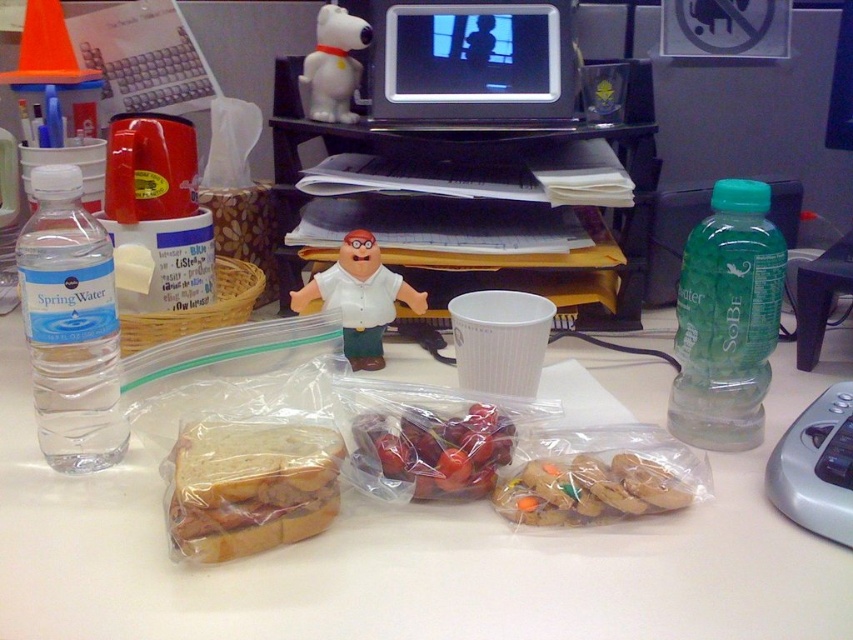
Question: Among these points, which one is farthest from the camera?

Choices:
 (A) (560, 93)
 (B) (419, 477)
 (C) (735, 346)
 (D) (334, 65)

Answer: (D)

Question: Is translucent plastic sandwich at center to the right of translucent plastic bag of gummy candies at center from the viewer's perspective?

Choices:
 (A) no
 (B) yes

Answer: (A)

Question: Which point is farther from the camera taking this photo?

Choices:
 (A) (354, 24)
 (B) (544, 29)
 (C) (549, 518)

Answer: (B)

Question: Does white matte figurine at center appear over white plastic snoopy at upper center?

Choices:
 (A) no
 (B) yes

Answer: (A)

Question: Does translucent plastic sandwich at center have a greater width compared to white matte figurine at center?

Choices:
 (A) no
 (B) yes

Answer: (A)

Question: Which of the following is the closest to the observer?

Choices:
 (A) (67, 224)
 (B) (227, 460)
 (C) (572, 605)
 (D) (302, 296)

Answer: (C)